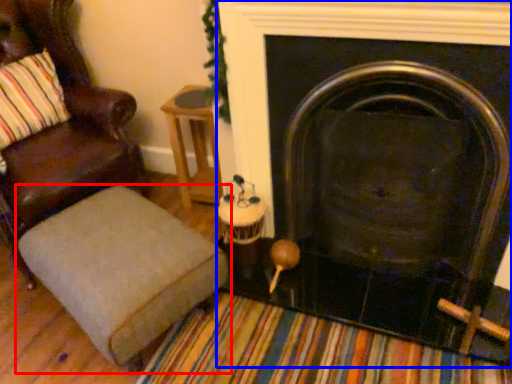
Question: Which object is closer to the camera taking this photo, furniture (highlighted by a red box) or fireplace (highlighted by a blue box)?

Choices:
 (A) furniture
 (B) fireplace

Answer: (B)